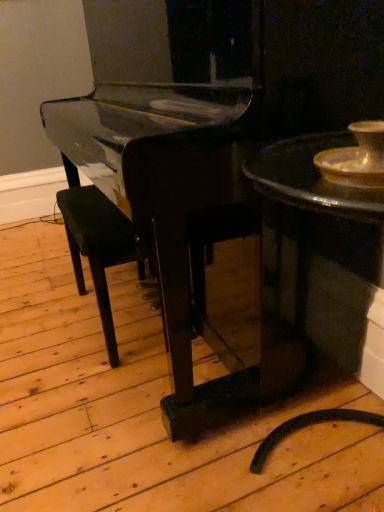
Question: Is black wood armchair at center inside or outside of shiny dark wood table at right?

Choices:
 (A) inside
 (B) outside

Answer: (B)

Question: From the image's perspective, relative to shiny dark wood table at right, is black wood armchair at center above or below?

Choices:
 (A) above
 (B) below

Answer: (A)

Question: Is black wood armchair at center to the left or to the right of shiny dark wood table at right in the image?

Choices:
 (A) left
 (B) right

Answer: (A)

Question: Is point (312, 189) closer or farther from the camera than point (77, 286)?

Choices:
 (A) closer
 (B) farther

Answer: (A)

Question: Is shiny dark wood table at right in front of or behind black wood armchair at center in the image?

Choices:
 (A) behind
 (B) front

Answer: (B)

Question: Based on their sizes in the image, would you say shiny dark wood table at right is bigger or smaller than black wood armchair at center?

Choices:
 (A) big
 (B) small

Answer: (A)

Question: From the image's perspective, is shiny dark wood table at right above or below black wood armchair at center?

Choices:
 (A) below
 (B) above

Answer: (A)